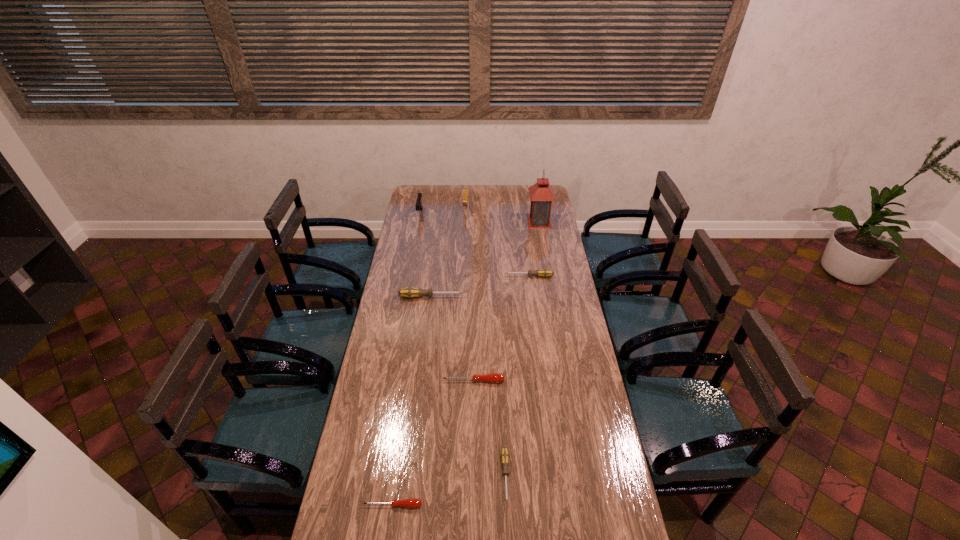
Locate an element on the screen. blank region between the right red screwdriver and the nearest gray screwdriver is located at coordinates (490, 429).

Where is `free spot between the left pistol and the right pistol`? The width and height of the screenshot is (960, 540). free spot between the left pistol and the right pistol is located at coordinates (443, 212).

Where is `object that stands as the second closest to the fourth farthest object`? object that stands as the second closest to the fourth farthest object is located at coordinates (541, 194).

The width and height of the screenshot is (960, 540). What are the coordinates of `object that stands as the fifth closest to the right red screwdriver` in the screenshot? It's located at (541, 194).

Locate an element on the screen. screwdriver that is the third closest one to the left pistol is located at coordinates (493, 377).

Identify which screwdriver is the second nearest to the nearest gray screwdriver. Please provide its 2D coordinates. Your answer should be formatted as a tuple, i.e. [(x, y)], where the tuple contains the x and y coordinates of a point satisfying the conditions above.

[(493, 377)]

Find the location of `the closest gray screwdriver to the second gray screwdriver from right to left`. the closest gray screwdriver to the second gray screwdriver from right to left is located at coordinates (410, 292).

Choose which gray screwdriver is the second nearest neighbor to the third nearest object. Please provide its 2D coordinates. Your answer should be formatted as a tuple, i.e. [(x, y)], where the tuple contains the x and y coordinates of a point satisfying the conditions above.

[(410, 292)]

Identify the location of free region that satisfies the following two spatial constraints: 1. on the front-facing side of the left pistol; 2. on the left side of the sixth farthest object. (389, 381).

Identify the location of vacant space that satisfies the following two spatial constraints: 1. on the front-facing side of the third nearest object; 2. on the right side of the left pistol. The width and height of the screenshot is (960, 540). [x=389, y=381].